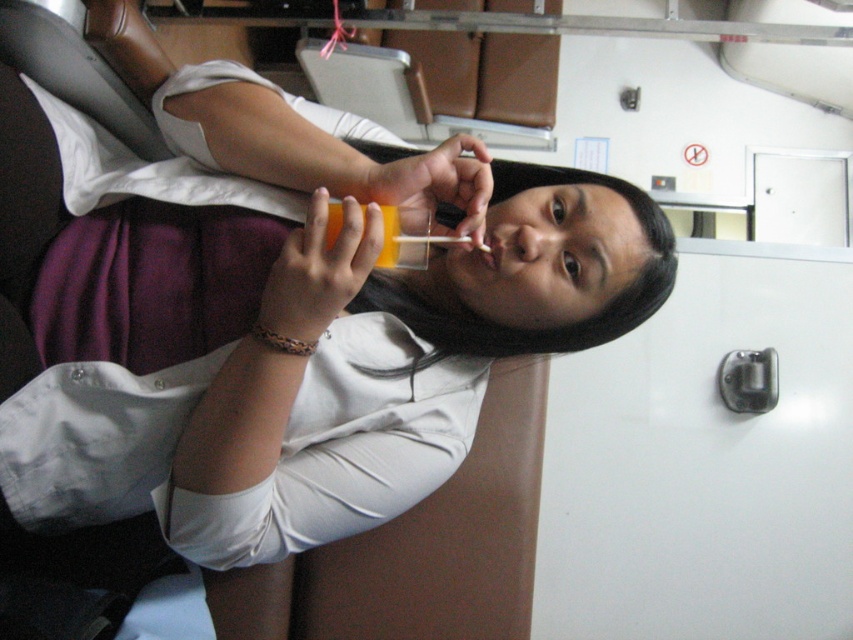
Consider the image. You are taking a photo of the person holding the drink. The camera is at your eye level. Which point, point [276,348] or point [480,257], is closer to the camera?

Point [276,348] is closer to the camera than point [480,257].

You are a bartender who needs to pour the orange drink from the matte orange cup at center into the matte plastic mouth at center. Will the cup fit into the mouth without spilling?

The matte orange cup at center might be wider than matte plastic mouth at center, so there is a possibility of spilling if the cup cannot fit properly into the mouth.

You are a designer creating a new accessory collection. You observe the multicolored woven bracelet at center and the matte plastic mouth at center in the image. Which object is larger in size?

The multicolored woven bracelet at center is bigger than the matte plastic mouth at center.